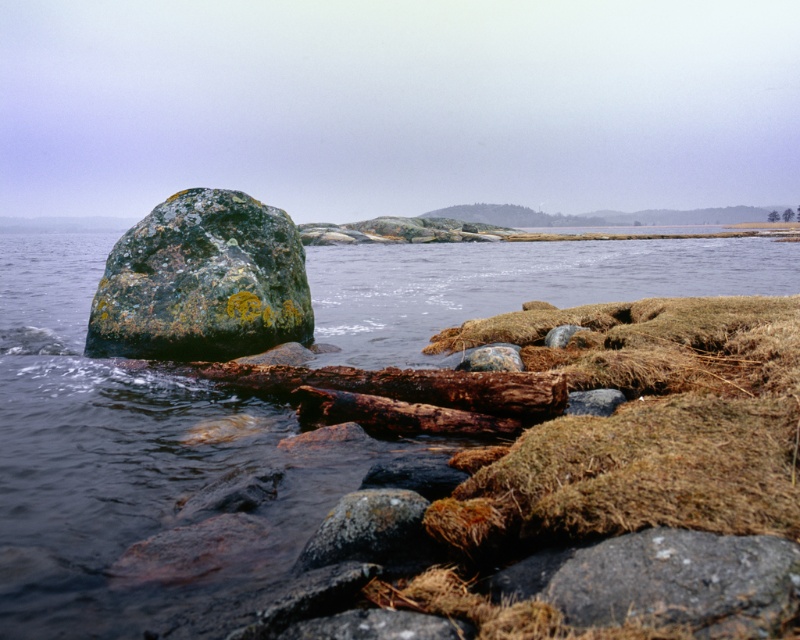
Question: Is green mossy water at center above brown rough log at center?

Choices:
 (A) no
 (B) yes

Answer: (B)

Question: Can you confirm if green mossy water at center is positioned below lichen-covered rock at center?

Choices:
 (A) no
 (B) yes

Answer: (A)

Question: Which point is farther to the camera?

Choices:
 (A) (85, 477)
 (B) (128, 308)
 (C) (362, 417)

Answer: (B)

Question: Can you confirm if green mossy water at center is wider than lichen-covered rock at left?

Choices:
 (A) yes
 (B) no

Answer: (A)

Question: Which of the following is the farthest from the observer?

Choices:
 (A) (49, 420)
 (B) (294, 394)
 (C) (158, 218)
 (D) (420, 554)

Answer: (C)

Question: Which is nearer to the green mossy water at center?

Choices:
 (A) lichen-covered rock at left
 (B) brown rough log at center
 (C) lichen-covered rock at center

Answer: (A)